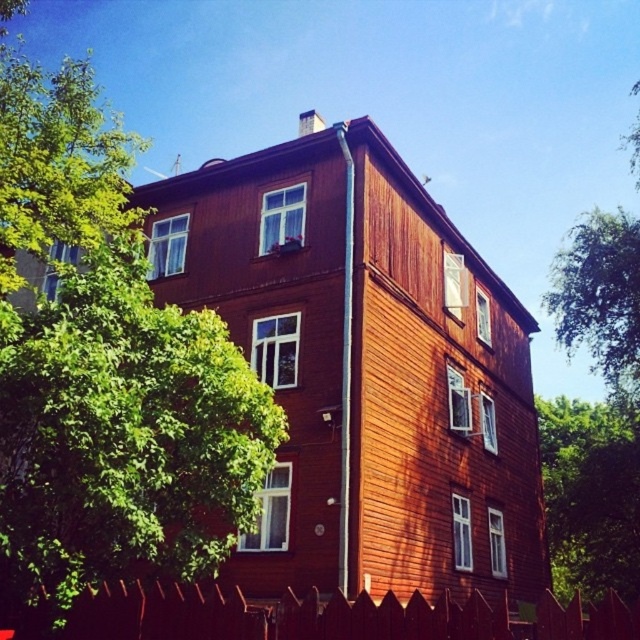
Question: Based on their relative distances, which object is nearer to the green leafy tree at upper left?

Choices:
 (A) smooth wooden fence at lower center
 (B) green leafy tree at center

Answer: (A)

Question: From the image, what is the correct spatial relationship of green leafy tree at upper left in relation to smooth wooden fence at lower center?

Choices:
 (A) left
 (B) right

Answer: (A)

Question: Which point appears farthest from the camera in this image?

Choices:
 (A) (241, 612)
 (B) (76, 378)

Answer: (B)

Question: Which object appears closest to the camera in this image?

Choices:
 (A) smooth wooden fence at lower center
 (B) green leafy tree at center

Answer: (A)

Question: Is smooth wooden fence at lower center bigger than green leafy tree at center?

Choices:
 (A) no
 (B) yes

Answer: (B)

Question: Where is smooth wooden fence at lower center located in relation to green leafy tree at center in the image?

Choices:
 (A) right
 (B) left

Answer: (B)